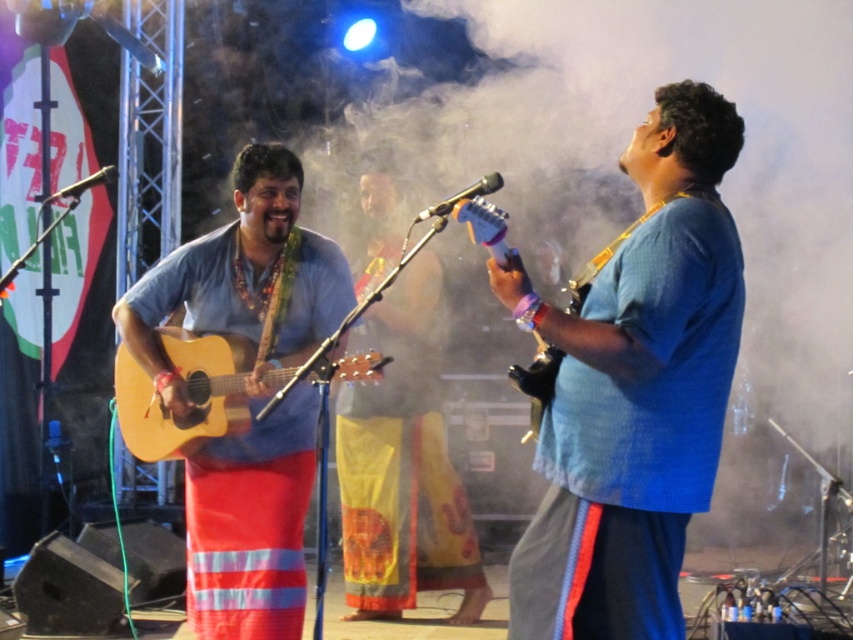
Question: Does blue cotton shirt at center have a greater width compared to matte wood guitar at left?

Choices:
 (A) no
 (B) yes

Answer: (A)

Question: Does matte wood guitar at left appear on the right side of acoustic wood guitar at left?

Choices:
 (A) yes
 (B) no

Answer: (B)

Question: Which object is positioned farthest from the acoustic wood guitar at left?

Choices:
 (A) blue cotton shirt at center
 (B) matte wood guitar at left
 (C) matte wood guitar at center

Answer: (A)

Question: Estimate the real-world distances between objects in this image. Which object is closer to the matte wood guitar at left?

Choices:
 (A) blue cotton shirt at center
 (B) acoustic wood guitar at left
 (C) matte wood guitar at center

Answer: (B)

Question: Which point is farther from the camera taking this photo?

Choices:
 (A) (183, 358)
 (B) (664, 323)

Answer: (A)

Question: Does acoustic wood guitar at left appear under matte wood guitar at center?

Choices:
 (A) no
 (B) yes

Answer: (B)